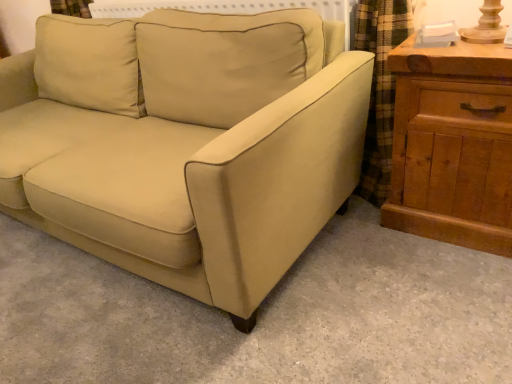
At what (x,y) coordinates should I click in order to perform the action: click on beige fabric couch at center. Please return your answer as a coordinate pair (x, y). This screenshot has width=512, height=384. Looking at the image, I should click on (192, 148).

The width and height of the screenshot is (512, 384). What do you see at coordinates (192, 148) in the screenshot? I see `beige fabric couch at center` at bounding box center [192, 148].

In order to face wooden chest of drawers at right, should I rotate leftwards or rightwards?

To face it directly, rotate right by 25.707 degrees.

This screenshot has width=512, height=384. What do you see at coordinates (452, 145) in the screenshot?
I see `wooden chest of drawers at right` at bounding box center [452, 145].

Identify the location of wooden chest of drawers at right. click(x=452, y=145).

Find the location of a particular element. beige fabric couch at center is located at coordinates (192, 148).

Considering the relative positions of beige fabric couch at center and wooden chest of drawers at right in the image provided, is beige fabric couch at center to the left of wooden chest of drawers at right from the viewer's perspective?

Indeed, beige fabric couch at center is positioned on the left side of wooden chest of drawers at right.

Is the depth of beige fabric couch at center less than that of wooden chest of drawers at right?

Yes, it is in front of wooden chest of drawers at right.

Is point (284, 224) closer or farther from the camera than point (413, 221)?

Point (284, 224) is positioned closer to the camera compared to point (413, 221).

From the image's perspective, which one is positioned lower, beige fabric couch at center or wooden chest of drawers at right?

From the image's view, wooden chest of drawers at right is below.

From a real-world perspective, is beige fabric couch at center on wooden chest of drawers at right?

Yes, from a real-world perspective, beige fabric couch at center is on top of wooden chest of drawers at right.

In the scene shown: Between beige fabric couch at center and wooden chest of drawers at right, which one has larger width?

With larger width is beige fabric couch at center.

Is beige fabric couch at center shorter than wooden chest of drawers at right?

In fact, beige fabric couch at center may be taller than wooden chest of drawers at right.

Can you confirm if beige fabric couch at center is smaller than wooden chest of drawers at right?

Actually, beige fabric couch at center might be larger than wooden chest of drawers at right.

Is beige fabric couch at center situated inside wooden chest of drawers at right or outside?

beige fabric couch at center is outside wooden chest of drawers at right.

Is there a large distance between beige fabric couch at center and wooden chest of drawers at right?

beige fabric couch at center is actually quite close to wooden chest of drawers at right.

Is beige fabric couch at center oriented away from wooden chest of drawers at right?

No, wooden chest of drawers at right is not at the back of beige fabric couch at center.

At what (x,y) coordinates should I click in order to perform the action: click on chest of drawers below the beige fabric couch at center (from a real-world perspective). Please return your answer as a coordinate pair (x, y). Looking at the image, I should click on (452, 145).

Is wooden chest of drawers at right to the left or to the right of beige fabric couch at center in the image?

In the image, wooden chest of drawers at right appears on the right side of beige fabric couch at center.

Which object is more forward, wooden chest of drawers at right or beige fabric couch at center?

beige fabric couch at center is closer to the camera.

Between point (509, 187) and point (122, 67), which one is positioned in front?

The point (509, 187) is more forward.

From the image's perspective, between wooden chest of drawers at right and beige fabric couch at center, which one is located above?

beige fabric couch at center.

From a real-world perspective, is wooden chest of drawers at right on top of beige fabric couch at center?

No, from a real-world perspective, wooden chest of drawers at right is not on top of beige fabric couch at center.

Does wooden chest of drawers at right have a lesser width compared to beige fabric couch at center?

Yes, wooden chest of drawers at right is thinner than beige fabric couch at center.

Considering the sizes of wooden chest of drawers at right and beige fabric couch at center in the image, is wooden chest of drawers at right taller or shorter than beige fabric couch at center?

In the image, wooden chest of drawers at right appears to be shorter than beige fabric couch at center.

Can you confirm if wooden chest of drawers at right is smaller than beige fabric couch at center?

Yes, wooden chest of drawers at right is smaller than beige fabric couch at center.

Is wooden chest of drawers at right not within beige fabric couch at center?

That's correct, wooden chest of drawers at right is outside of beige fabric couch at center.

Is the surface of wooden chest of drawers at right in direct contact with beige fabric couch at center?

wooden chest of drawers at right and beige fabric couch at center are clearly separated.

Is wooden chest of drawers at right oriented towards beige fabric couch at center?

No.

This screenshot has height=384, width=512. Find the location of `studio couch positioned vertically above the wooden chest of drawers at right (from a real-world perspective)`. studio couch positioned vertically above the wooden chest of drawers at right (from a real-world perspective) is located at coordinates (192, 148).

Locate an element on the screen. The height and width of the screenshot is (384, 512). studio couch in front of the wooden chest of drawers at right is located at coordinates (192, 148).

The image size is (512, 384). In order to click on chest of drawers behind the beige fabric couch at center in this screenshot , I will do `click(452, 145)`.